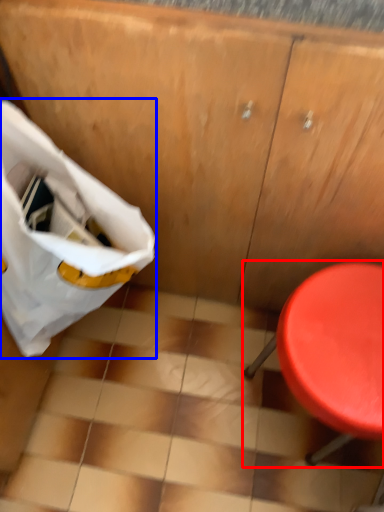
Question: Among these objects, which one is farthest to the camera, furniture (highlighted by a red box) or grocery bag (highlighted by a blue box)?

Choices:
 (A) furniture
 (B) grocery bag

Answer: (A)